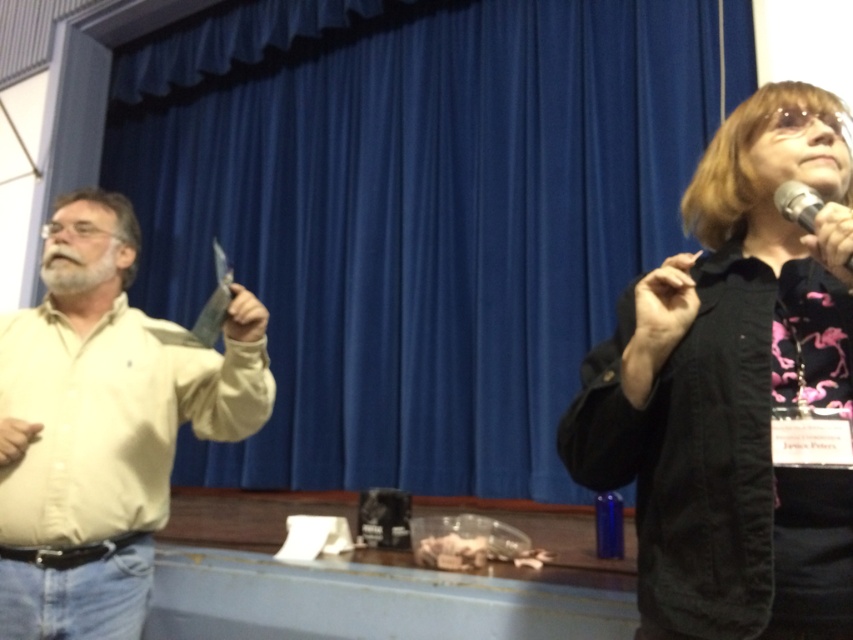
Does black matte jacket at upper right appear on the right side of black metallic microphone at upper right?

No, black matte jacket at upper right is not to the right of black metallic microphone at upper right.

Describe the element at coordinates (733, 388) in the screenshot. This screenshot has height=640, width=853. I see `black matte jacket at upper right` at that location.

Where is `black matte jacket at upper right`? The height and width of the screenshot is (640, 853). black matte jacket at upper right is located at coordinates click(x=733, y=388).

Image resolution: width=853 pixels, height=640 pixels. I want to click on black matte jacket at upper right, so pos(733,388).

Which is more to the right, black matte jacket at upper right or light yellow shirt at left?

black matte jacket at upper right is more to the right.

Does point (677, 330) come farther from viewer compared to point (123, 529)?

No.

Locate an element on the screen. black matte jacket at upper right is located at coordinates (733, 388).

Who is higher up, blue fabric curtain at center or black metallic microphone at upper right?

blue fabric curtain at center is higher up.

Locate an element on the screen. This screenshot has height=640, width=853. blue fabric curtain at center is located at coordinates (412, 216).